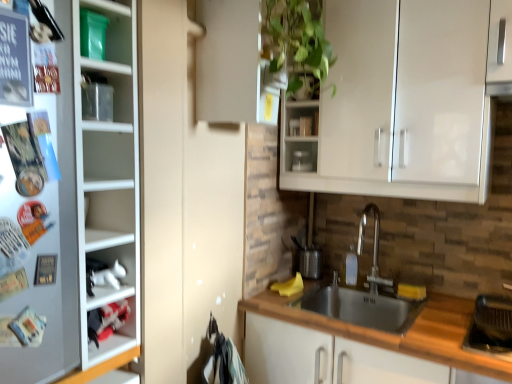
Question: From a real-world perspective, relative to green matte plant at upper center, is stainless steel sink at lower center vertically above or below?

Choices:
 (A) below
 (B) above

Answer: (A)

Question: In terms of width, does stainless steel sink at lower center look wider or thinner when compared to green matte plant at upper center?

Choices:
 (A) thin
 (B) wide

Answer: (B)

Question: Considering the real-world distances, which object is farthest from the metallic silver container at upper center?

Choices:
 (A) green matte plant at upper center
 (B) polished stainless steel faucet at center
 (C) stainless steel sink at lower center
 (D) white plastic cabinet at lower left, acting as the 2th cabinet starting from the top
 (E) white glossy cabinet at lower left, which is counted as the first cabinet, starting from the top

Answer: (D)

Question: Which object is the farthest from the white glossy cabinet at upper center?

Choices:
 (A) stainless steel sink at lower center
 (B) polished stainless steel faucet at center
 (C) white glossy cabinet at lower left, which is counted as the first cabinet, starting from the top
 (D) metallic silver container at upper center
 (E) green matte plant at upper center

Answer: (B)